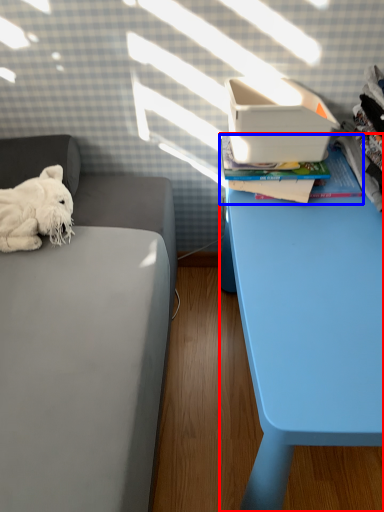
Question: Which point is closer to the camera, table (highlighted by a red box) or paperback book (highlighted by a blue box)?

Choices:
 (A) table
 (B) paperback book

Answer: (A)